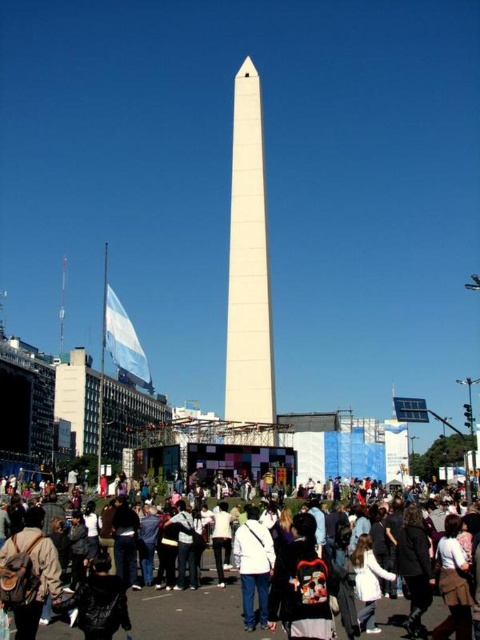
You are a photographer standing in the plaza and want to capture both the matte black backpacks at lower center and the white matte jacket at center in a single photo. Based on their positions, which object should you focus on first to ensure both are in frame?

Since the matte black backpacks at lower center is located below the white matte jacket at center, you should focus on the white matte jacket at center first to ensure both are in frame.

You are a photographer standing in the plaza. You want to take a photo that includes both the white smooth obelisk at center and the white matte jacket at center. Which object should you zoom in on to ensure both are clearly visible in the frame?

The white smooth obelisk at center is bigger than the white matte jacket at center, so you should zoom in on the smaller object, the white matte jacket at center, to ensure both are clearly visible in the frame.

You are a photographer trying to capture the white smooth obelisk at center and the matte black backpacks at lower center in a single shot. Based on their sizes, which object would appear larger in your photo?

The white smooth obelisk at center would appear larger in the photo because it is bigger than the matte black backpacks at lower center.